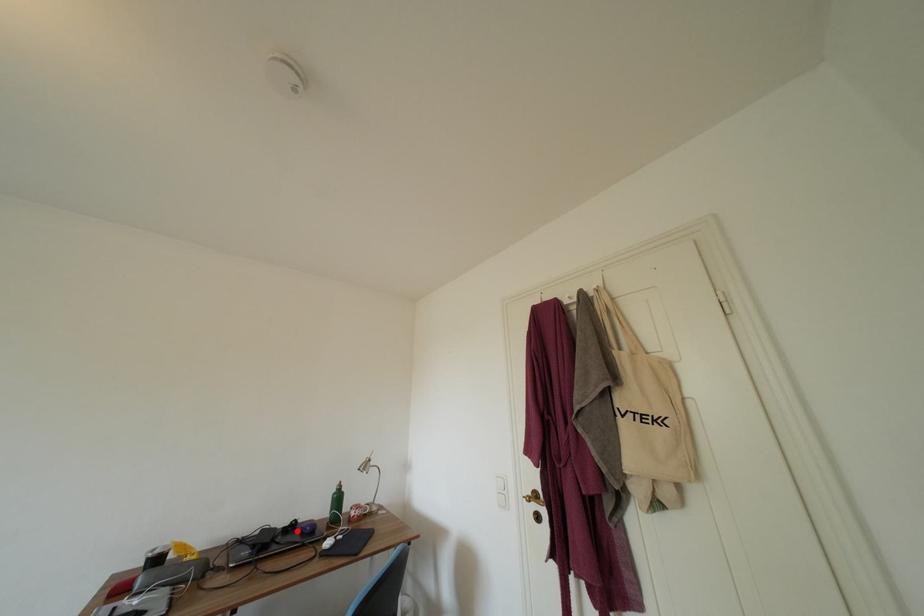
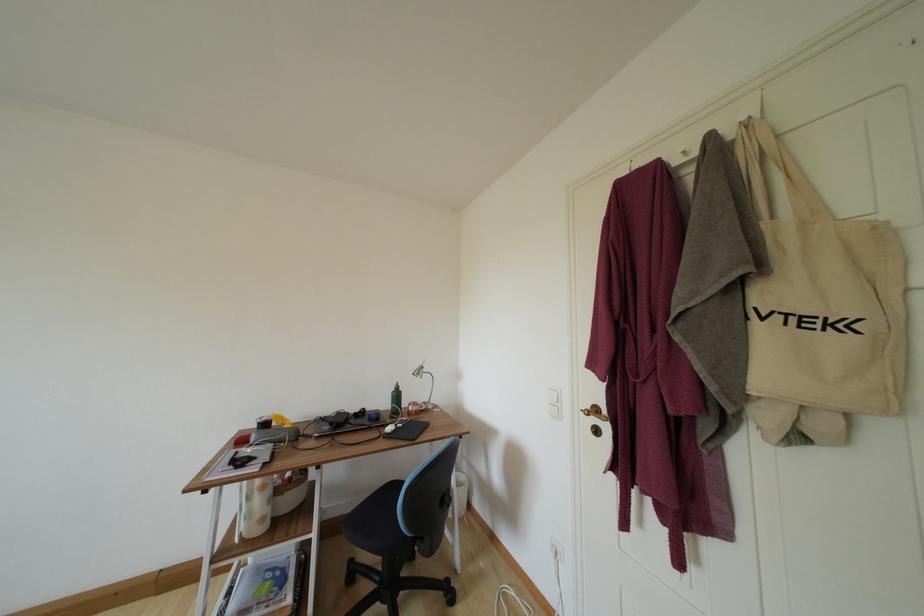
Find the pixel in the second image that matches the highlighted location in the first image.

(367, 416)